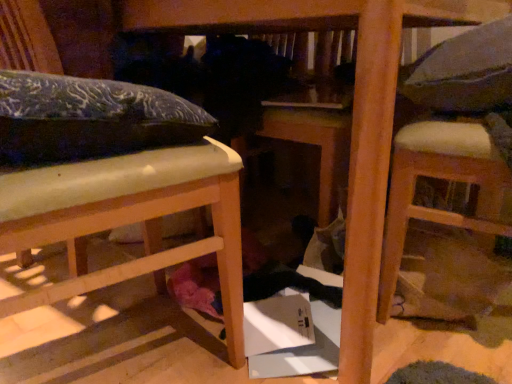
Identify the location of free spot below matte wood bed at left, the 2th furniture when ordered from right to left (from a real-world perspective). Image resolution: width=512 pixels, height=384 pixels. (126, 349).